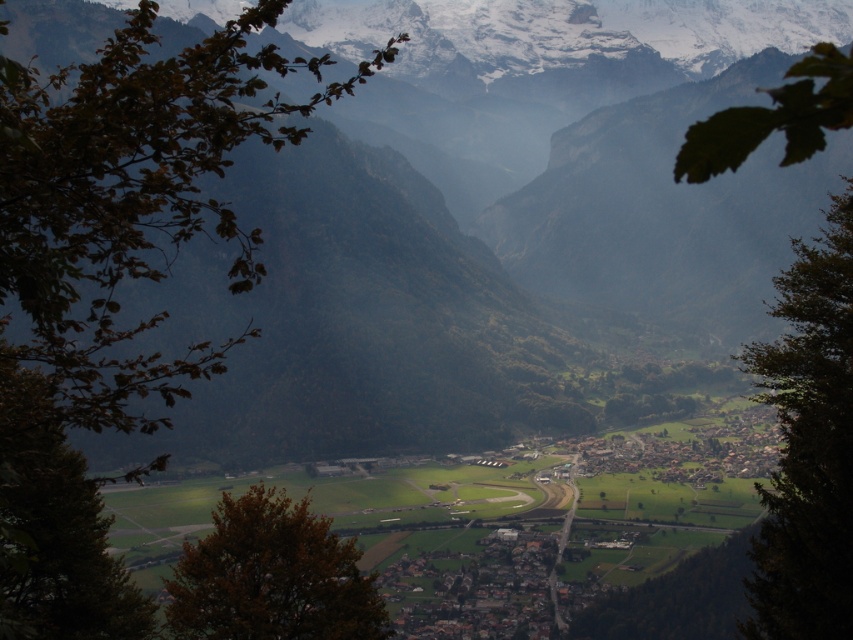
Is point (132, 371) more distant than point (850, 300)?

No, (132, 371) is closer to viewer.

You are a GUI agent. You are given a task and a screenshot of the screen. Output one action in this format:
    pyautogui.click(x=<x>, y=<y>)
    Task: Click on the brown leafy branch at upper left
    
    Given the screenshot: What is the action you would take?
    pyautogui.click(x=129, y=200)

Locate an element on the screen. The width and height of the screenshot is (853, 640). brown leafy branch at upper left is located at coordinates (129, 200).

Which is above, green grassy field at center or green matte tree at left?

Positioned higher is green grassy field at center.

Is point (393, 376) in front of point (67, 493)?

No, it is behind (67, 493).

Find the location of a particular element. Image resolution: width=853 pixels, height=640 pixels. green grassy field at center is located at coordinates (471, 268).

The width and height of the screenshot is (853, 640). What are the coordinates of `green leafy tree at right` in the screenshot? It's located at (808, 444).

The width and height of the screenshot is (853, 640). Identify the location of green leafy tree at right. (808, 444).